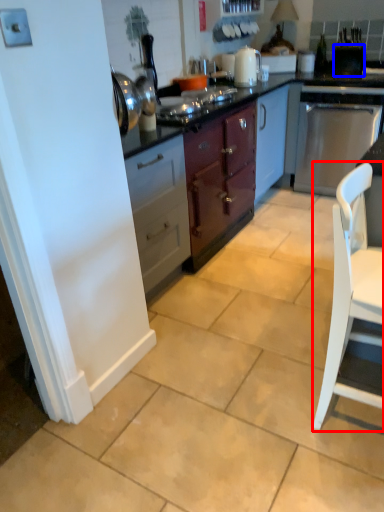
Question: Which point is further to the camera, chair (highlighted by a red box) or appliance (highlighted by a blue box)?

Choices:
 (A) chair
 (B) appliance

Answer: (B)